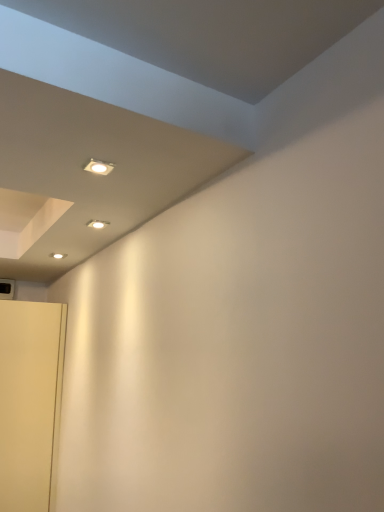
Question: Considering the positions of point (96, 161) and point (9, 329), is point (96, 161) closer or farther from the camera than point (9, 329)?

Choices:
 (A) closer
 (B) farther

Answer: (A)

Question: Considering the relative positions of matte white light fixture at upper center and white matte door at lower left in the image provided, is matte white light fixture at upper center to the left or to the right of white matte door at lower left?

Choices:
 (A) right
 (B) left

Answer: (A)

Question: From their relative heights in the image, would you say matte white light fixture at upper center is taller or shorter than white matte door at lower left?

Choices:
 (A) short
 (B) tall

Answer: (A)

Question: From a real-world perspective, is white matte door at lower left physically located above or below matte white light fixture at upper center?

Choices:
 (A) below
 (B) above

Answer: (A)

Question: Is white matte door at lower left taller or shorter than matte white light fixture at upper center?

Choices:
 (A) short
 (B) tall

Answer: (B)

Question: Is point (56, 430) positioned closer to the camera than point (97, 166)?

Choices:
 (A) farther
 (B) closer

Answer: (A)

Question: In the image, is white matte door at lower left on the left side or the right side of matte white light fixture at upper center?

Choices:
 (A) right
 (B) left

Answer: (B)